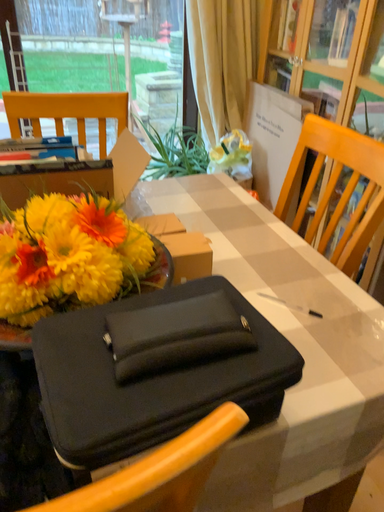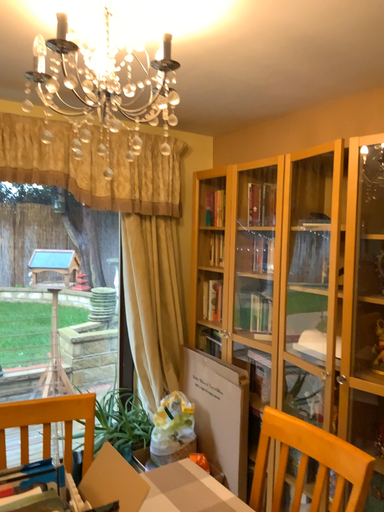
Question: Which way did the camera rotate in the video?

Choices:
 (A) rotated downward
 (B) rotated upward

Answer: (B)